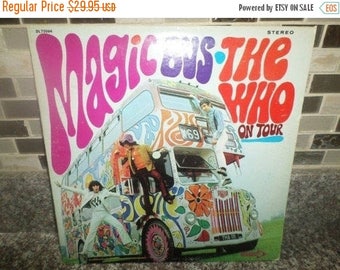
You are a GUI agent. You are given a task and a screenshot of the screen. Output one action in this format:
    pyautogui.click(x=<x>, y=<y>)
    Task: Click on the window
    This screenshot has height=270, width=340.
    Given the screenshot: What is the action you would take?
    pyautogui.click(x=73, y=178)